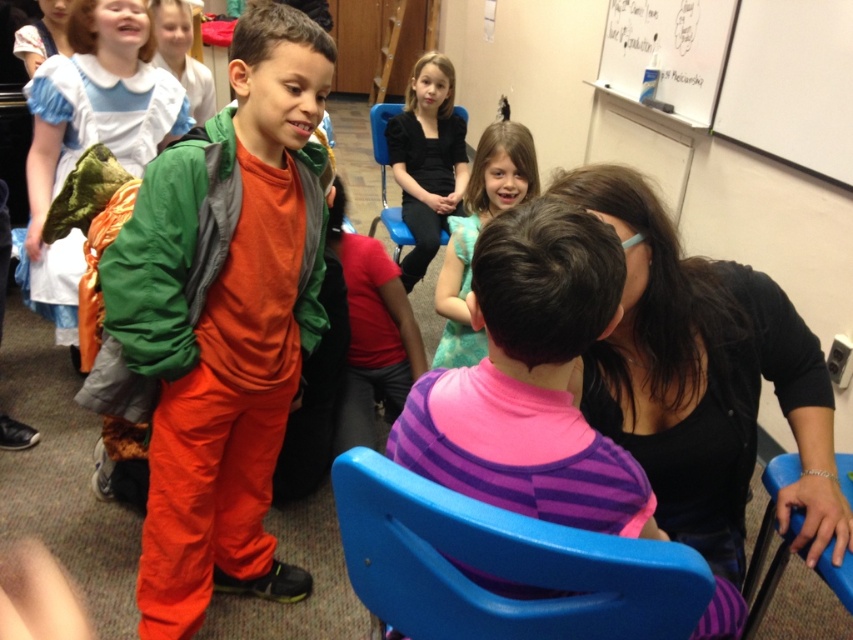
Can you confirm if blue plastic chair at lower center is bigger than whiteboard at upper right?

Actually, blue plastic chair at lower center might be smaller than whiteboard at upper right.

Is point (650, 595) farther from viewer compared to point (663, 24)?

No.

In order to click on blue plastic chair at lower center in this screenshot , I will do `click(502, 564)`.

Can you confirm if matte green jacket at center is positioned below teal satin dress at center?

Indeed, matte green jacket at center is positioned under teal satin dress at center.

Measure the distance between matte green jacket at center and camera.

A distance of 1.24 meters exists between matte green jacket at center and camera.

Which is in front, point (210, 557) or point (453, 216)?

Point (210, 557) is in front.

You are a GUI agent. You are given a task and a screenshot of the screen. Output one action in this format:
    pyautogui.click(x=<x>, y=<y>)
    Task: Click on the matte green jacket at center
    The image size is (853, 640).
    Given the screenshot: What is the action you would take?
    pyautogui.click(x=224, y=324)

Can you confirm if black matte shirt at center is positioned below white matte board at upper right?

Correct, black matte shirt at center is located below white matte board at upper right.

Describe the element at coordinates (704, 380) in the screenshot. The image size is (853, 640). I see `black matte shirt at center` at that location.

Is point (682, 324) in front of point (755, 65)?

Yes, point (682, 324) is closer to viewer.

Locate an element on the screen. The image size is (853, 640). black matte shirt at center is located at coordinates (704, 380).